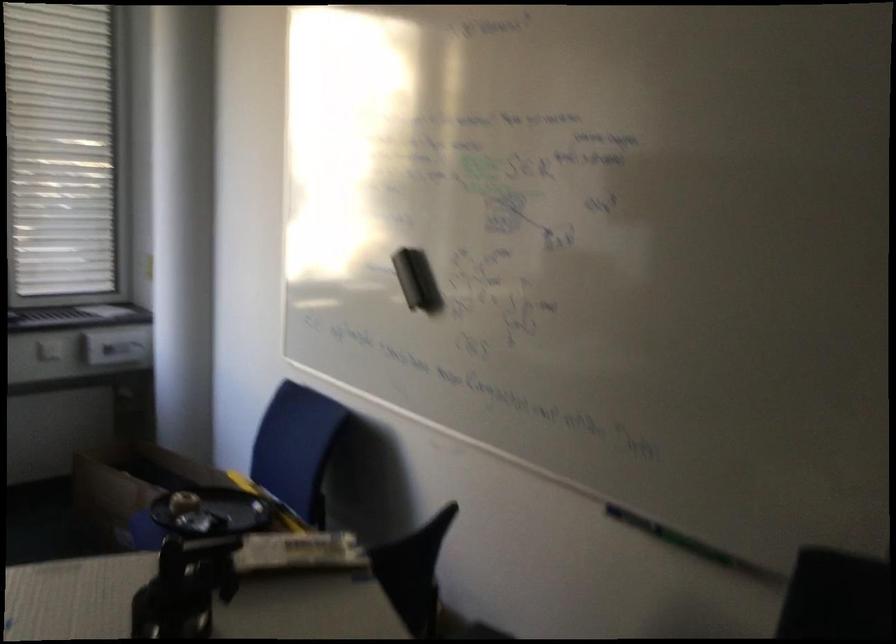
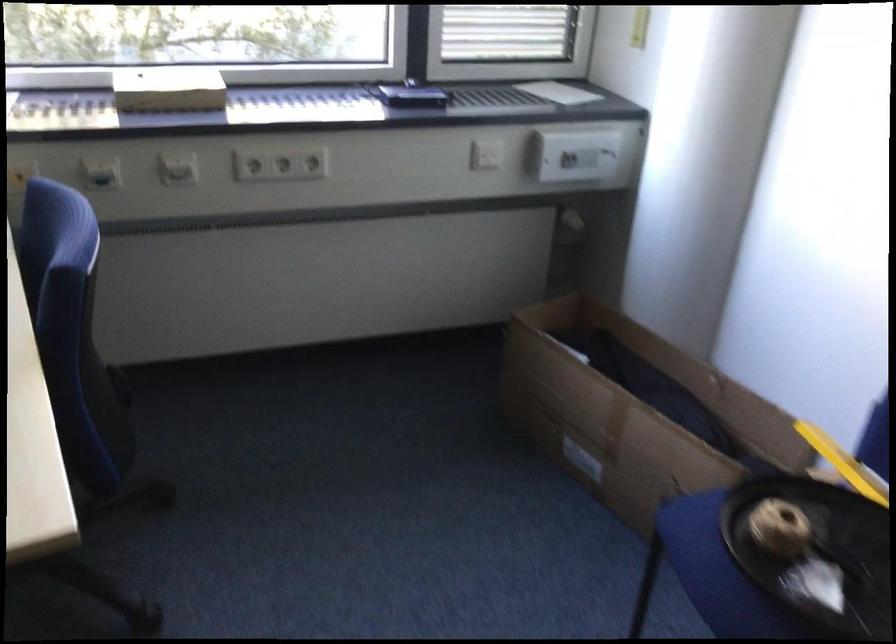
Locate, in the second image, the point that corresponds to (131,397) in the first image.

(570, 225)